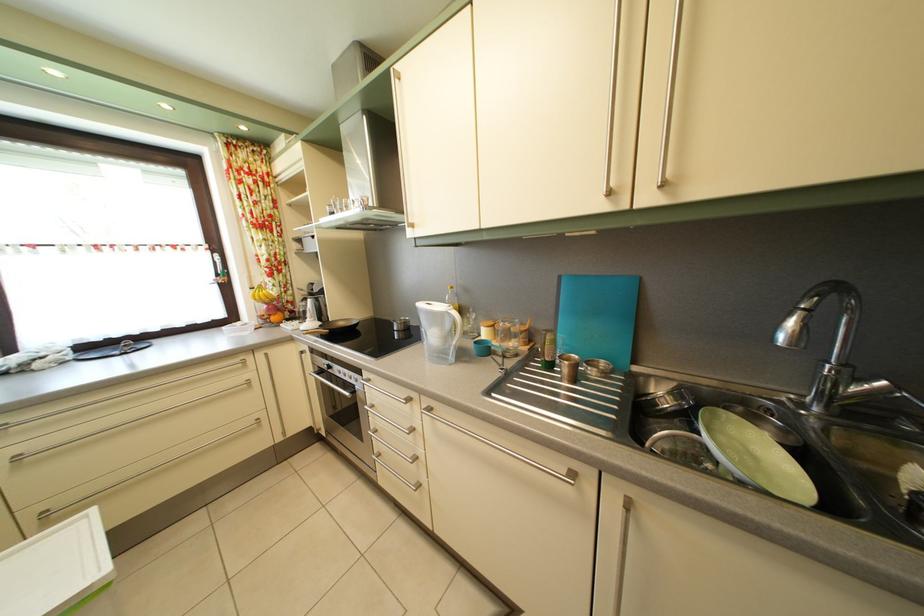
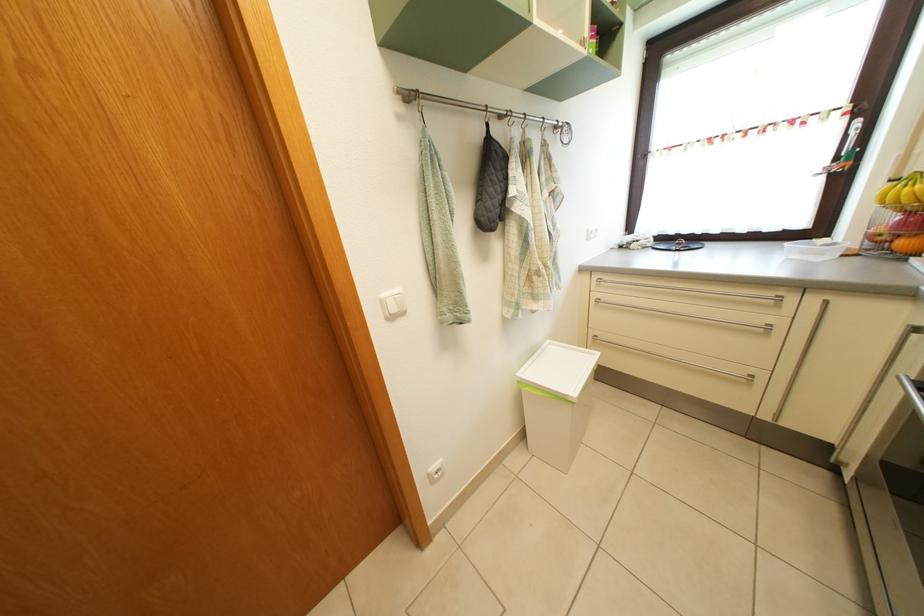
In the second image, find the point that corresponds to the point at 283,326 in the first image.

(910, 252)